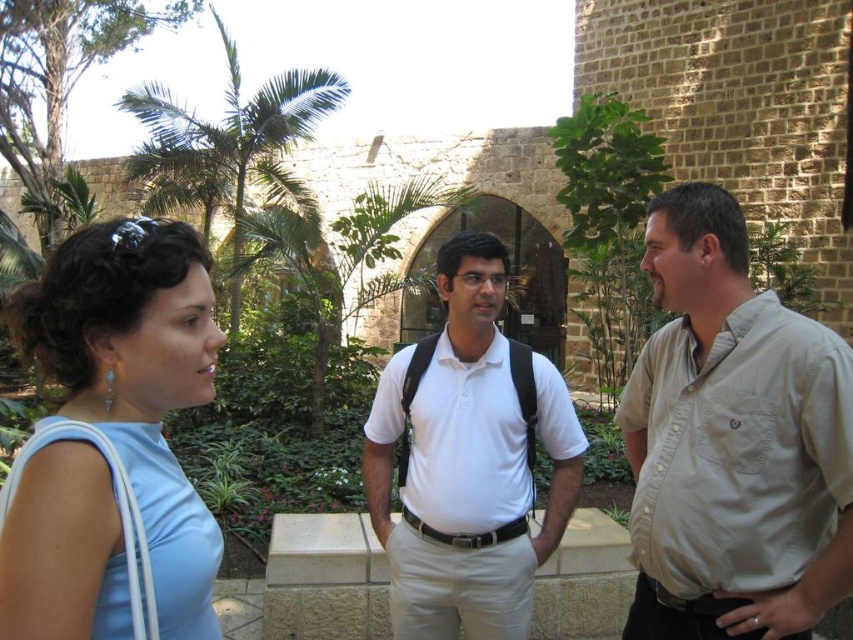
You are a photographer trying to capture a candid shot of the two people in the scene. You want to ensure that both the light blue fabric dress at left and the white matte shirt at center are clearly visible in the frame. Based on their positions, which direction should you position yourself relative to the subjects to best capture both individuals?

To capture both the light blue fabric dress at left and the white matte shirt at center, position yourself to the right of the subjects since the light blue fabric dress at left is to the left of the white matte shirt at center, placing you on the right side would allow you to see both subjects side by side in the frame.

You are standing in the garden and want to hand a note to the person wearing the matte white shirt at center. Based on their position relative to the woman in the light blue sleeveless top, where should you approach from?

The matte white shirt at center is located behind the woman in the light blue sleeveless top, so you should approach from behind the woman to reach the matte white shirt at center.

You are standing in the garden scene and want to hand a note to the person wearing the khaki shirt at right. Based on their position in the image, which direction should you walk to reach them?

The khaki shirt at right is located at point 0.691 on the x axis and 0.859 on the y axis, so you should walk towards the upper right direction in the image to reach them.